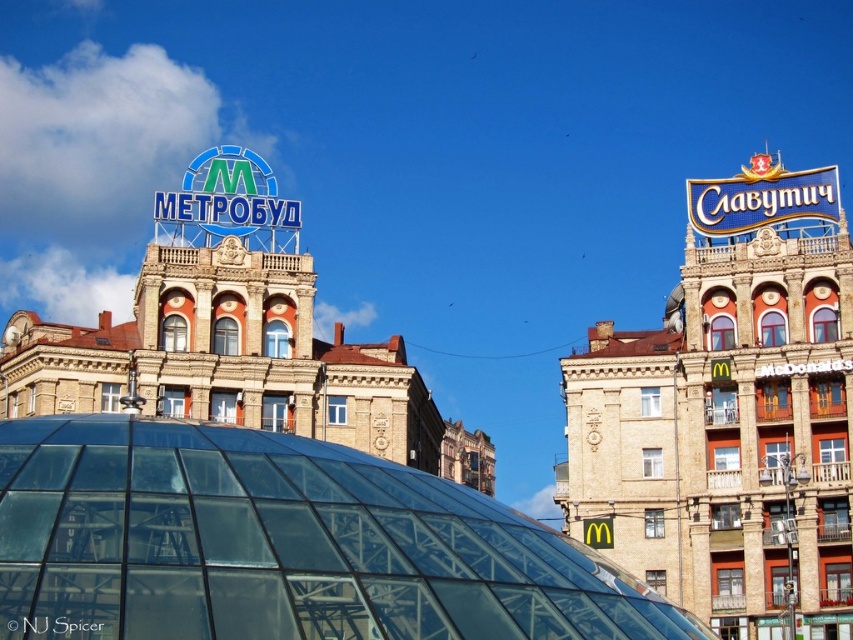
Question: Does transparent glass dome at center appear over blue metallic signboard at upper right?

Choices:
 (A) yes
 (B) no

Answer: (B)

Question: Which object is closer to the camera taking this photo?

Choices:
 (A) blue metallic signboard at upper right
 (B) transparent glass dome at center

Answer: (B)

Question: Does transparent glass dome at center appear on the left side of blue metallic signboard at upper right?

Choices:
 (A) yes
 (B) no

Answer: (A)

Question: Can you confirm if transparent glass dome at center is positioned to the left of blue metallic signboard at upper right?

Choices:
 (A) no
 (B) yes

Answer: (B)

Question: Which point is farther from the camera taking this photo?

Choices:
 (A) (354, 531)
 (B) (726, 275)

Answer: (B)